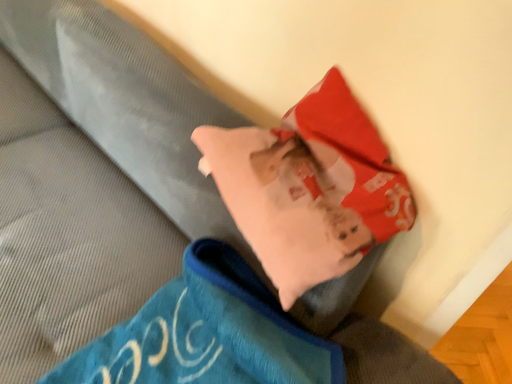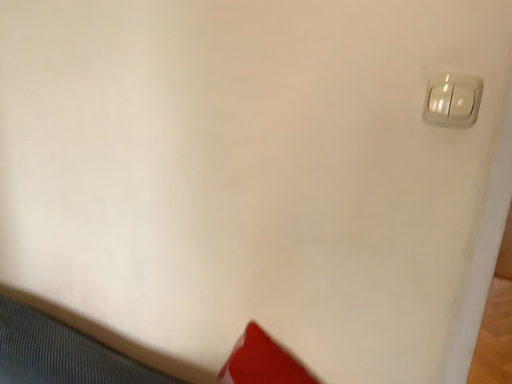
Question: Which way did the camera rotate in the video?

Choices:
 (A) rotated downward
 (B) rotated upward

Answer: (B)